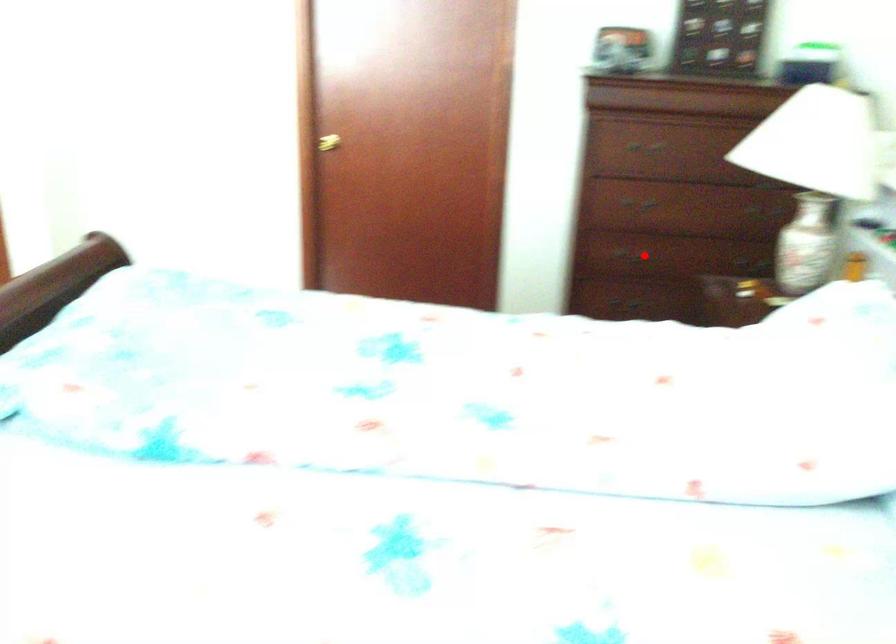
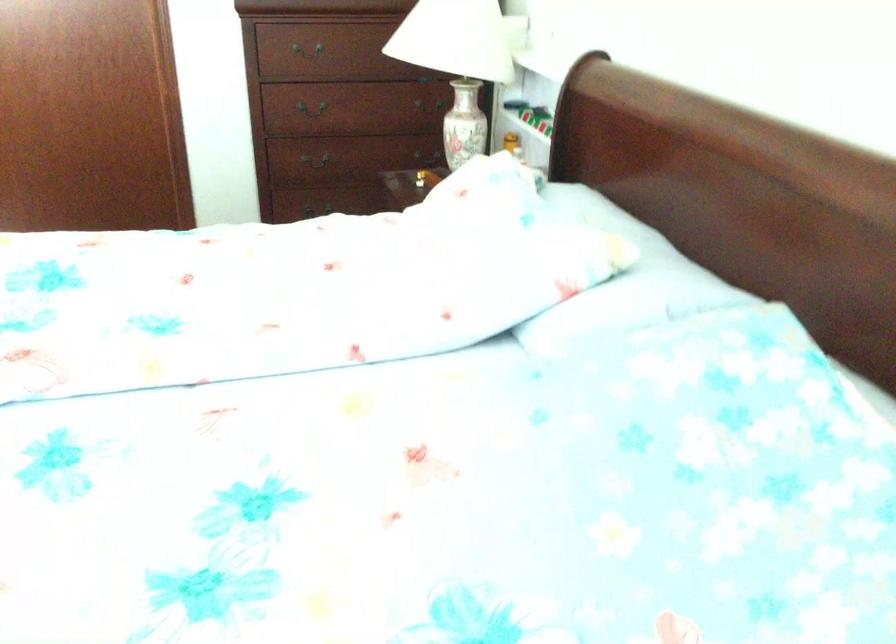
Locate, in the second image, the point that corresponds to the highlighted location in the first image.

(323, 158)